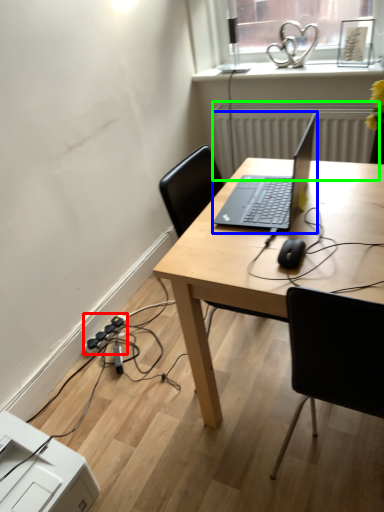
Question: Which object is positioned farthest from extension cord (highlighted by a red box)? Select from laptop (highlighted by a blue box) and radiator (highlighted by a green box).

Choices:
 (A) laptop
 (B) radiator

Answer: (B)